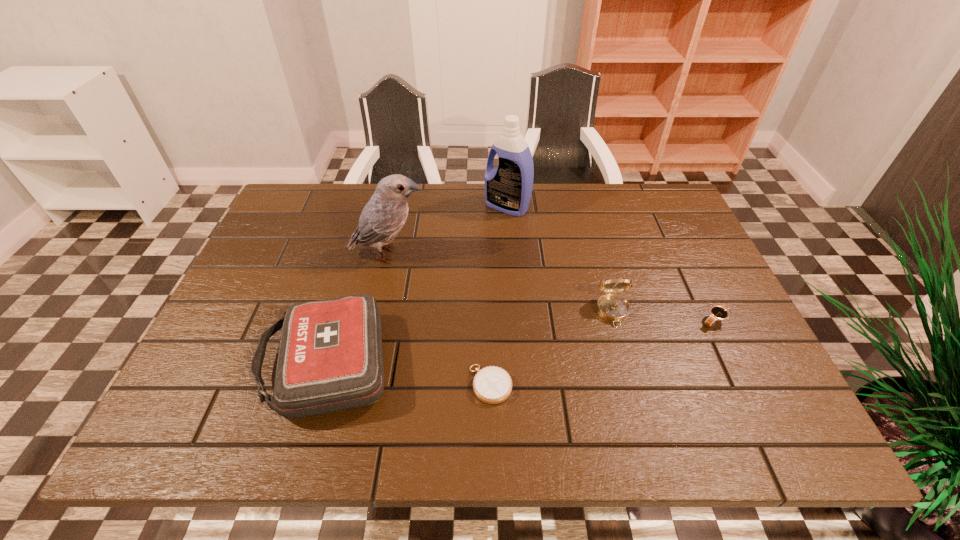
At what (x,y) coordinates should I click in order to perform the action: click on free location that satisfies the following two spatial constraints: 1. on the back side of the farthest object; 2. on the right side of the first-aid kit. Please return your answer as a coordinate pair (x, y). Looking at the image, I should click on (372, 207).

This screenshot has width=960, height=540. I want to click on vacant position in the image that satisfies the following two spatial constraints: 1. on the front-facing side of the parrot; 2. on the back side of the rightmost object, so click(374, 320).

In order to click on vacant position in the image that satisfies the following two spatial constraints: 1. on the front-facing side of the parrot; 2. on the left side of the watch in this screenshot , I will do `click(374, 320)`.

At what (x,y) coordinates should I click in order to perform the action: click on free location that satisfies the following two spatial constraints: 1. with the dial facing the watch; 2. on the left side of the fifth object from left to right. Please return your answer as a coordinate pair (x, y). Image resolution: width=960 pixels, height=540 pixels. Looking at the image, I should click on (615, 320).